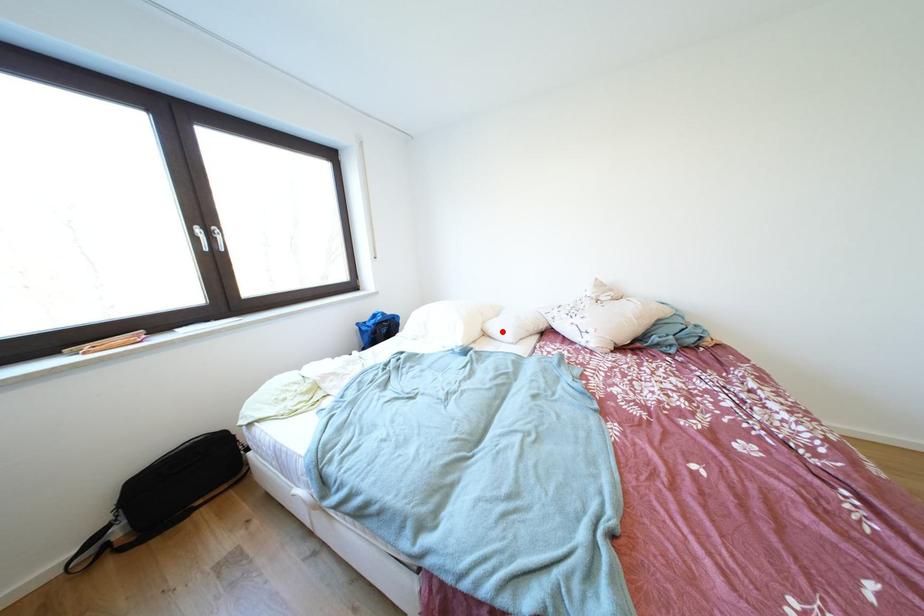
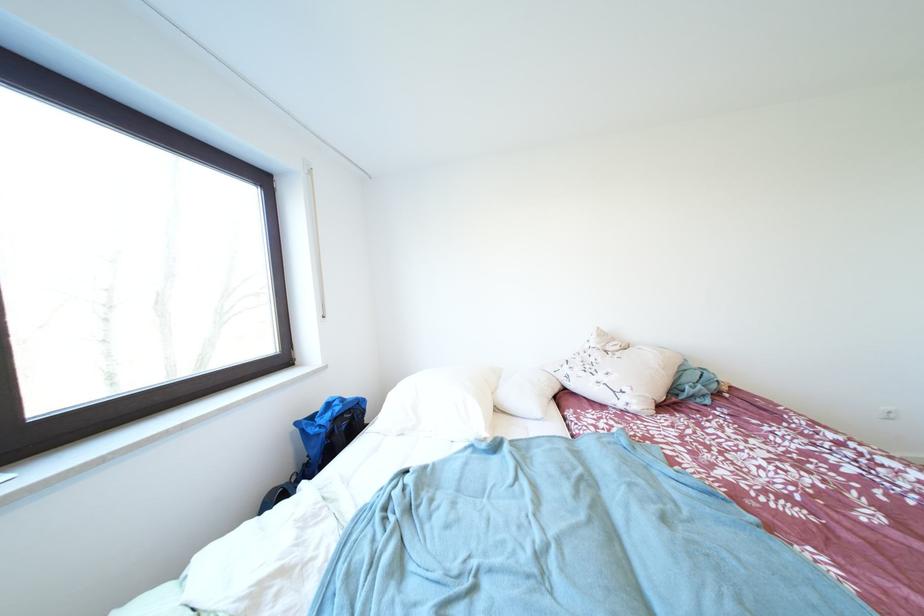
Find the pixel in the second image that matches the highlighted location in the first image.

(517, 403)